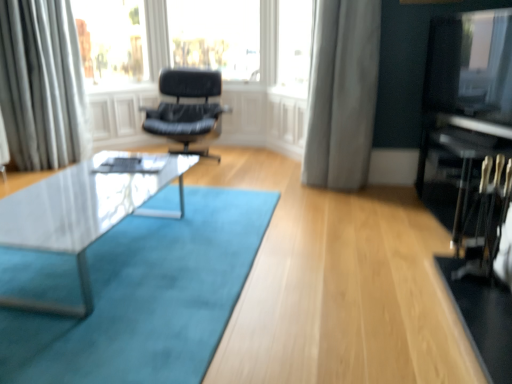
Question: Is silky white curtain at upper left, which is counted as the 1th curtain, starting from the left, at the back of transparent glass at upper left?

Choices:
 (A) no
 (B) yes

Answer: (A)

Question: Can you confirm if transparent glass at upper left is bigger than silky white curtain at upper left, which is counted as the 1th curtain, starting from the left?

Choices:
 (A) no
 (B) yes

Answer: (A)

Question: Is transparent glass at upper left positioned beyond the bounds of silky white curtain at upper left, the second curtain positioned from the right?

Choices:
 (A) yes
 (B) no

Answer: (A)

Question: From a real-world perspective, is transparent glass at upper left below silky white curtain at upper left, which is counted as the 1th curtain, starting from the left?

Choices:
 (A) no
 (B) yes

Answer: (A)

Question: Is the depth of transparent glass at upper left greater than that of silky white curtain at upper left, which is counted as the 1th curtain, starting from the left?

Choices:
 (A) yes
 (B) no

Answer: (A)

Question: Looking at the image, does silky white curtain at upper left, the second curtain positioned from the right, seem bigger or smaller compared to black glossy entertainment center at right?

Choices:
 (A) big
 (B) small

Answer: (A)

Question: Based on their positions, is silky white curtain at upper left, the second curtain positioned from the right, located to the left or right of black glossy entertainment center at right?

Choices:
 (A) left
 (B) right

Answer: (A)

Question: Is silky white curtain at upper left, the second curtain positioned from the right, inside or outside of black glossy entertainment center at right?

Choices:
 (A) outside
 (B) inside

Answer: (A)

Question: Considering the positions of point (65, 29) and point (471, 29), is point (65, 29) closer or farther from the camera than point (471, 29)?

Choices:
 (A) closer
 (B) farther

Answer: (B)

Question: Relative to black glossy entertainment center at right, is clear glass window at upper center in front or behind?

Choices:
 (A) behind
 (B) front

Answer: (A)

Question: Is clear glass window at upper center wider or thinner than black glossy entertainment center at right?

Choices:
 (A) wide
 (B) thin

Answer: (B)

Question: Considering the positions of point (297, 82) and point (421, 109), is point (297, 82) closer or farther from the camera than point (421, 109)?

Choices:
 (A) closer
 (B) farther

Answer: (B)

Question: Would you say clear glass window at upper center is inside or outside black glossy entertainment center at right?

Choices:
 (A) outside
 (B) inside

Answer: (A)

Question: Is point (120, 61) positioned closer to the camera than point (187, 152)?

Choices:
 (A) farther
 (B) closer

Answer: (A)

Question: Is transparent glass at upper left in front of or behind black leather chair at center in the image?

Choices:
 (A) behind
 (B) front

Answer: (A)